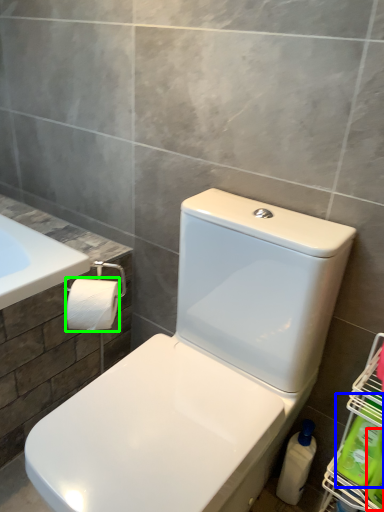
Question: Which is nearer to the cleaning product (highlighted by a red box)? cleaning product (highlighted by a blue box) or toilet paper (highlighted by a green box).

Choices:
 (A) cleaning product
 (B) toilet paper

Answer: (A)